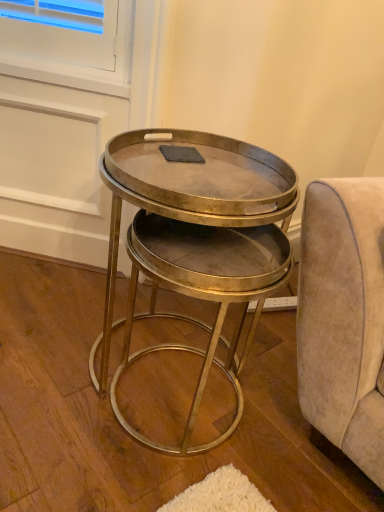
Question: From a real-world perspective, is metallic gold table at center located higher than gray matte rectangular pad at center?

Choices:
 (A) no
 (B) yes

Answer: (A)

Question: From a real-world perspective, is metallic gold table at center physically below gray matte rectangular pad at center?

Choices:
 (A) yes
 (B) no

Answer: (A)

Question: Does metallic gold table at center have a lesser width compared to gray matte rectangular pad at center?

Choices:
 (A) yes
 (B) no

Answer: (B)

Question: Is metallic gold table at center positioned before gray matte rectangular pad at center?

Choices:
 (A) no
 (B) yes

Answer: (B)

Question: Would you say gray matte rectangular pad at center is part of metallic gold table at center's contents?

Choices:
 (A) yes
 (B) no

Answer: (B)

Question: From the image's perspective, does metallic gold table at center appear lower than gray matte rectangular pad at center?

Choices:
 (A) no
 (B) yes

Answer: (B)

Question: Would you say gray matte rectangular pad at center contains metallic gold table at center?

Choices:
 (A) yes
 (B) no

Answer: (B)

Question: From a real-world perspective, does gray matte rectangular pad at center sit lower than metallic gold table at center?

Choices:
 (A) no
 (B) yes

Answer: (A)

Question: Is gray matte rectangular pad at center smaller than metallic gold table at center?

Choices:
 (A) no
 (B) yes

Answer: (B)

Question: Considering the relative sizes of gray matte rectangular pad at center and metallic gold table at center in the image provided, is gray matte rectangular pad at center shorter than metallic gold table at center?

Choices:
 (A) no
 (B) yes

Answer: (B)

Question: From the image's perspective, is gray matte rectangular pad at center beneath metallic gold table at center?

Choices:
 (A) yes
 (B) no

Answer: (B)

Question: Is the position of gray matte rectangular pad at center more distant than that of metallic gold table at center?

Choices:
 (A) no
 (B) yes

Answer: (B)

Question: Do you think metallic gold table at center is within gray matte rectangular pad at center, or outside of it?

Choices:
 (A) outside
 (B) inside

Answer: (A)